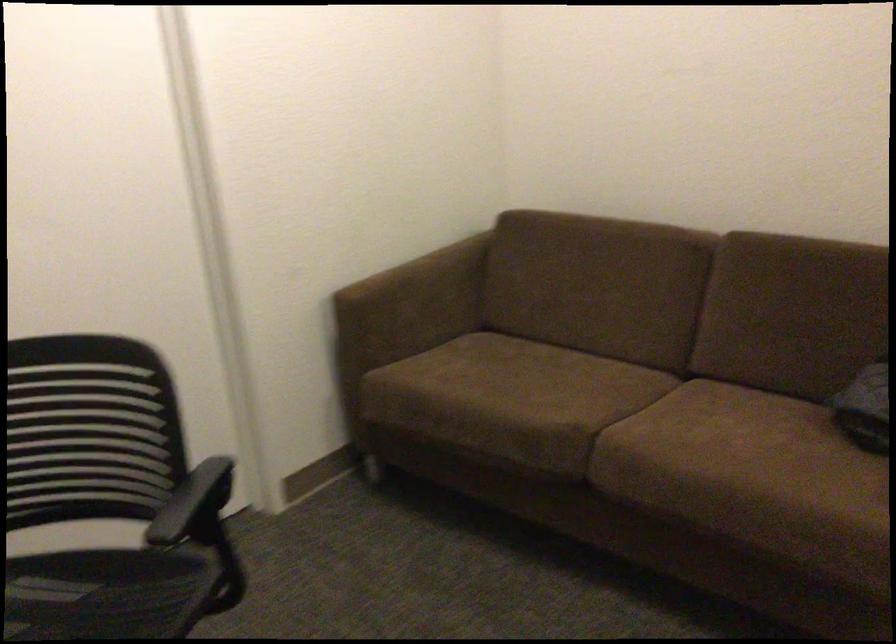
The image size is (896, 644). Identify the location of chair sitting surface. (98, 585).